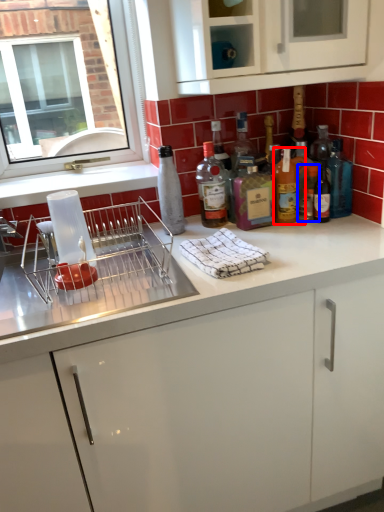
Question: Which of the following is the closest to the observer, bottle (highlighted by a red box) or bottle (highlighted by a blue box)?

Choices:
 (A) bottle
 (B) bottle

Answer: (A)